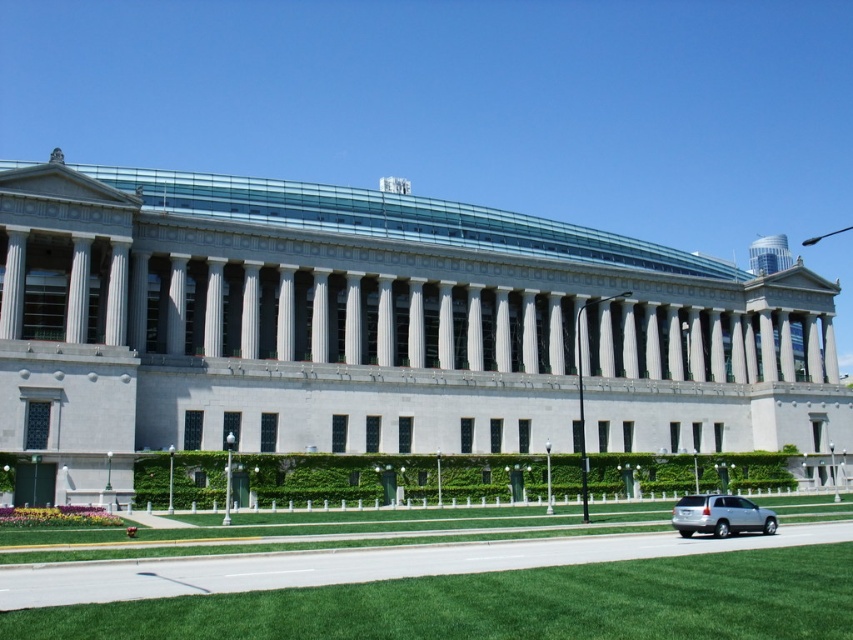
Which of these two, green grass at lower center or silver metallic suv at lower right, stands taller?

With more height is silver metallic suv at lower right.

Between point (22, 634) and point (752, 515), which one is positioned behind?

Point (752, 515)

Identify the location of green grass at lower center. (503, 604).